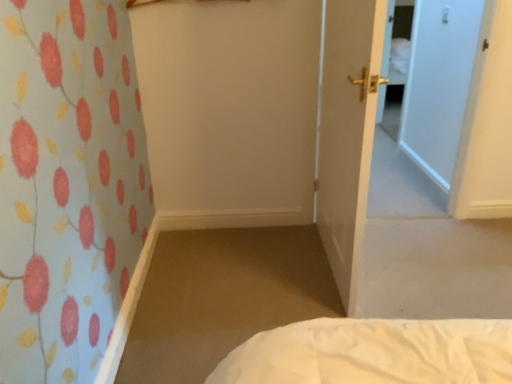
In order to click on gold metallic door handle at center in this screenshot , I will do `click(347, 133)`.

What do you see at coordinates (347, 133) in the screenshot?
I see `gold metallic door handle at center` at bounding box center [347, 133].

Identify the location of gold metallic door handle at center. The height and width of the screenshot is (384, 512). (347, 133).